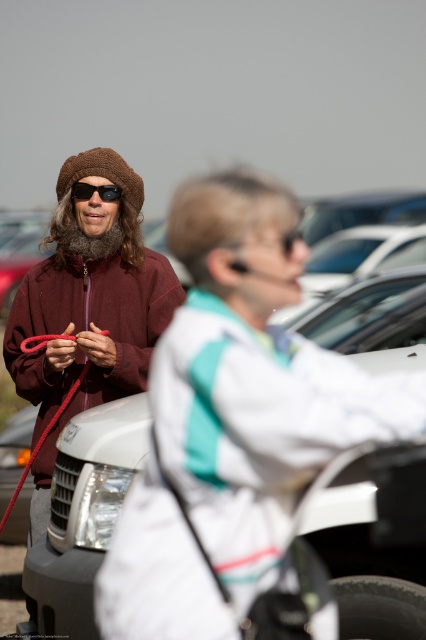
Between matte brown hat at left and black matte sunglasses at upper left, which one appears on the left side from the viewer's perspective?

From the viewer's perspective, matte brown hat at left appears more on the left side.

Where is `matte brown hat at left`? This screenshot has height=640, width=426. matte brown hat at left is located at coordinates (88, 308).

Where is `matte brown hat at left`? The image size is (426, 640). matte brown hat at left is located at coordinates (88, 308).

Who is positioned more to the left, white glossy car at left or matte brown hat at left?

From the viewer's perspective, matte brown hat at left appears more on the left side.

Can you confirm if white glossy car at left is positioned below matte brown hat at left?

Actually, white glossy car at left is above matte brown hat at left.

The image size is (426, 640). What do you see at coordinates (374, 541) in the screenshot?
I see `white glossy car at left` at bounding box center [374, 541].

Find the location of a particular element. This screenshot has height=640, width=426. white glossy car at left is located at coordinates (374, 541).

Can you confirm if matte brown hat at left is positioned to the left of red leather leash at left?

In fact, matte brown hat at left is to the right of red leather leash at left.

Who is more forward, (92, 387) or (20, 484)?

Point (20, 484) is more forward.

What are the coordinates of `matte brown hat at left` in the screenshot? It's located at (88, 308).